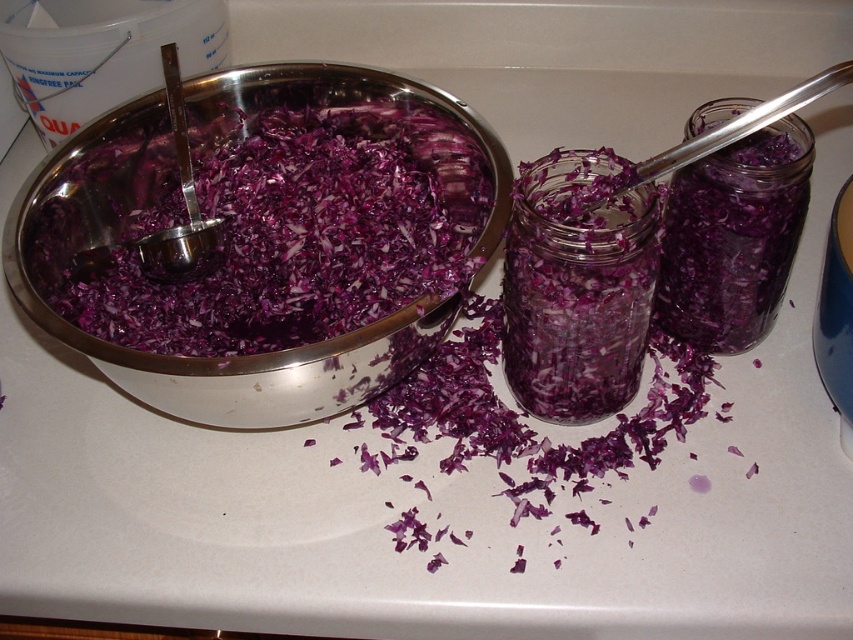
Question: Does translucent glass jar at center have a greater width compared to translucent glass jar at right?

Choices:
 (A) no
 (B) yes

Answer: (B)

Question: Is shiny metal bowl at center closer to camera compared to translucent glass jar at right?

Choices:
 (A) yes
 (B) no

Answer: (A)

Question: Estimate the real-world distances between objects in this image. Which object is farther from the shiny metal bowl at center?

Choices:
 (A) translucent glass jar at right
 (B) translucent glass jar at center

Answer: (A)

Question: Where is translucent glass jar at center located in relation to translucent glass jar at right in the image?

Choices:
 (A) right
 (B) left

Answer: (B)

Question: Among these points, which one is farthest from the camera?

Choices:
 (A) (604, 205)
 (B) (305, 417)

Answer: (A)

Question: Which point appears closest to the camera in this image?

Choices:
 (A) (503, 280)
 (B) (125, 388)

Answer: (B)